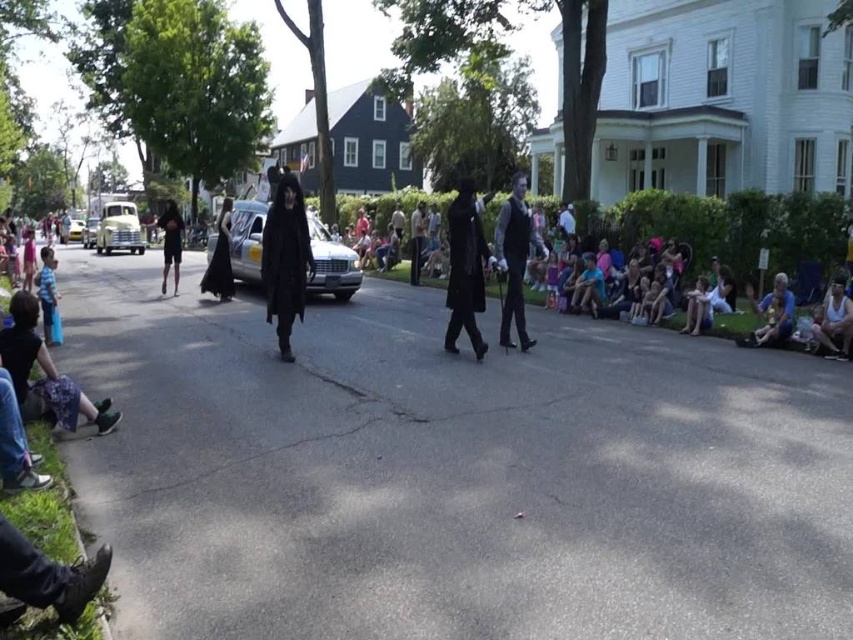
Question: Which is farther from the black matte dress at center?

Choices:
 (A) black matte coat at center
 (B) metallic silver hearse at center

Answer: (A)

Question: Is blue jeans at lower left to the right of white glossy car at center from the viewer's perspective?

Choices:
 (A) no
 (B) yes

Answer: (B)

Question: Can you confirm if yellow matte car at center is positioned to the left of white glossy car at center?

Choices:
 (A) no
 (B) yes

Answer: (B)

Question: Which of the following is the farthest from the observer?

Choices:
 (A) black matte dress at center
 (B) black matte shorts at center

Answer: (B)

Question: Can you confirm if black matte dress at center is smaller than black matte shorts at center?

Choices:
 (A) no
 (B) yes

Answer: (B)

Question: Which point is closer to the camera?

Choices:
 (A) yellow matte car at center
 (B) metallic silver hearse at center
 (C) black matte coat at center

Answer: (C)